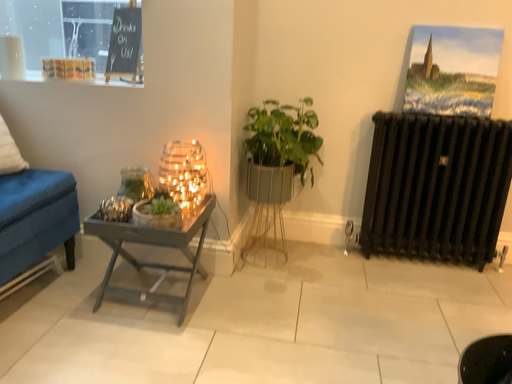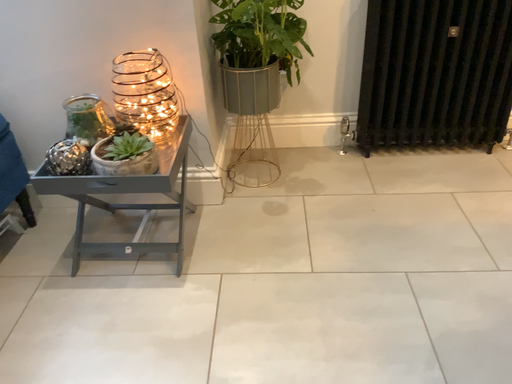
Question: Which way did the camera rotate in the video?

Choices:
 (A) rotated right
 (B) rotated left

Answer: (A)